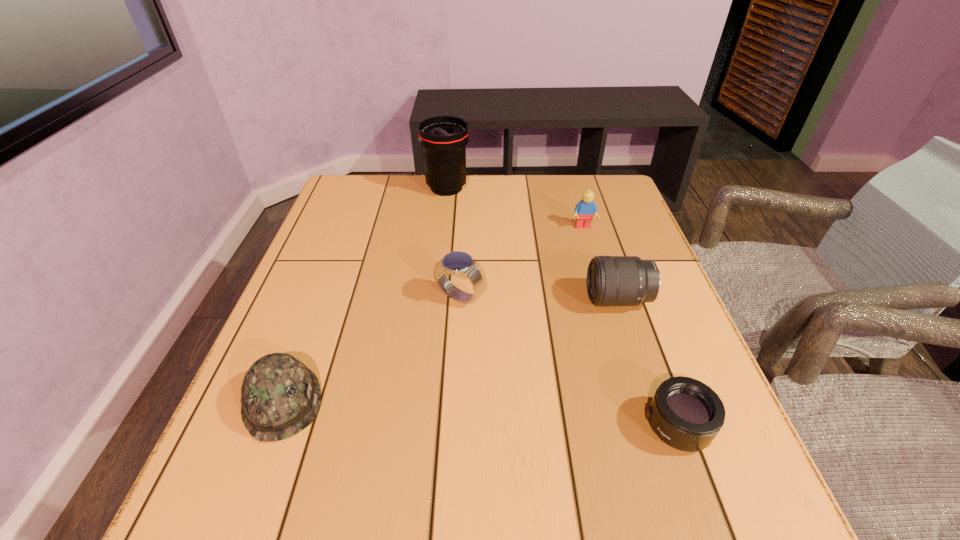
Where is `object present at the left edge`? The height and width of the screenshot is (540, 960). object present at the left edge is located at coordinates (280, 396).

Locate an element on the screen. This screenshot has width=960, height=540. Lego at the right edge is located at coordinates (584, 210).

The image size is (960, 540). In the image, there is a desktop. In order to click on free space at the far edge in this screenshot , I will do `click(540, 178)`.

Where is `free space at the left edge`? free space at the left edge is located at coordinates (332, 252).

This screenshot has height=540, width=960. In the image, there is a desktop. Identify the location of vacant space at the right edge. (631, 319).

Where is `free point at the far left corner`? This screenshot has width=960, height=540. free point at the far left corner is located at coordinates (372, 192).

Find the location of a particular element. This screenshot has height=540, width=960. vacant region at the near left corner is located at coordinates (263, 536).

The image size is (960, 540). I want to click on free space at the far right corner of the desktop, so click(568, 189).

I want to click on free space between the headwear and the nearest telephoto lens, so click(x=480, y=414).

Locate an element on the screen. unoccupied area between the second farthest telephoto lens and the leftmost object is located at coordinates (450, 350).